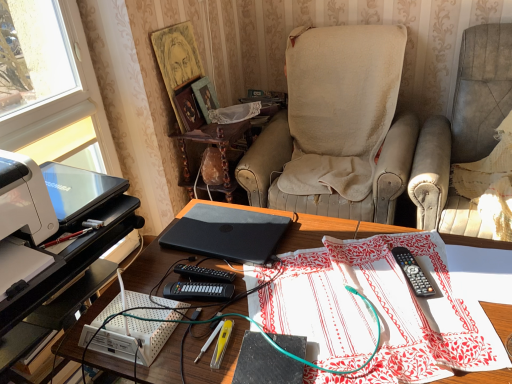
At what (x,y) coordinates should I click in order to perform the action: click on free space in front of black plastic keyboard at center, which appears as the first stationery when viewed from the left. Please return your answer as a coordinate pair (x, y). Looking at the image, I should click on (191, 339).